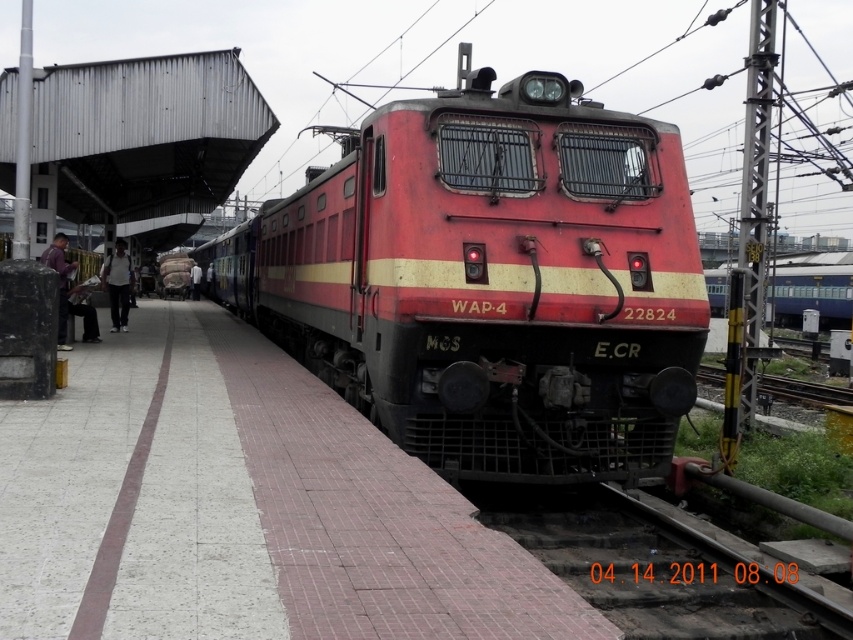
Question: Which object appears closest to the camera in this image?

Choices:
 (A) light gray fabric shirt at left
 (B) purple fabric bag at left
 (C) white clothed person at center

Answer: (B)

Question: Can you confirm if red matte train at center is thinner than white clothed person at center?

Choices:
 (A) yes
 (B) no

Answer: (B)

Question: Which point is closer to the camera?

Choices:
 (A) [x=64, y=294]
 (B) [x=93, y=564]

Answer: (B)

Question: Which object is positioned farthest from the purple fabric bag at left?

Choices:
 (A) red matte train at center
 (B) light gray fabric shirt at left
 (C) white clothed person at center

Answer: (C)

Question: Does red matte train at center have a greater width compared to white concrete platform at center?

Choices:
 (A) no
 (B) yes

Answer: (B)

Question: From the image, what is the correct spatial relationship of white concrete platform at center in relation to purple fabric bag at left?

Choices:
 (A) left
 (B) right

Answer: (B)